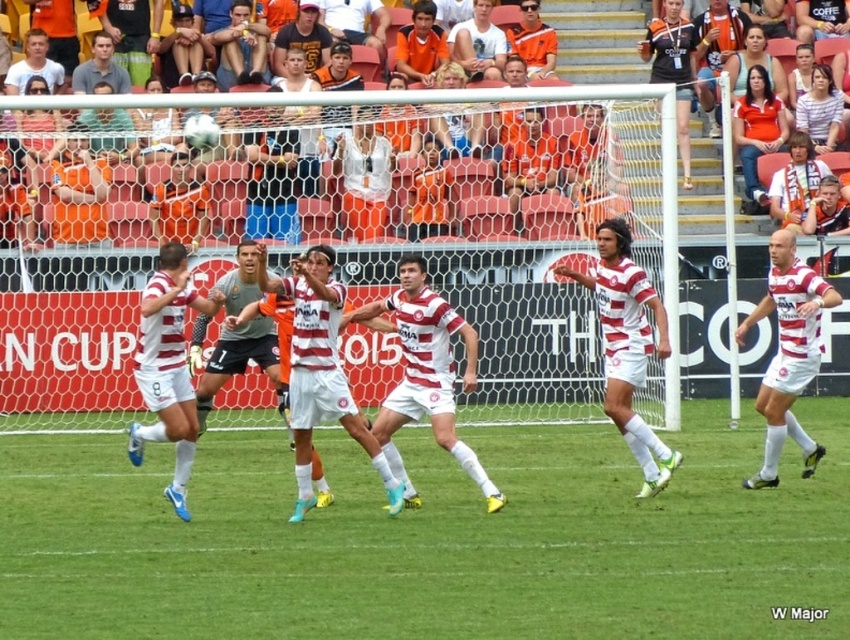
Question: Which of the following is the closest to the observer?

Choices:
 (A) (418, 412)
 (B) (180, 609)

Answer: (B)

Question: Which object appears farthest from the camera in this image?

Choices:
 (A) white striped jersey at center
 (B) green grass at center

Answer: (A)

Question: Is green grass at center positioned at the back of white matte jersey at center?

Choices:
 (A) no
 (B) yes

Answer: (A)

Question: Where is white matte jersey at center located in relation to white matte soccer player at center in the image?

Choices:
 (A) left
 (B) right

Answer: (B)

Question: In this image, where is white striped jersey at center located relative to white matte soccer player at center?

Choices:
 (A) left
 (B) right

Answer: (B)

Question: Based on their relative distances, which object is nearer to the white matte soccer player at center?

Choices:
 (A) matte black jersey at center
 (B) white striped jersey at center

Answer: (A)